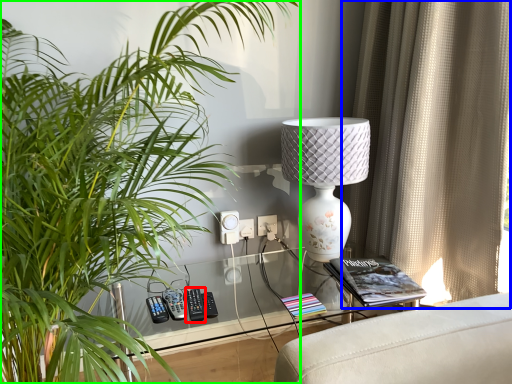
Question: Based on their relative distances, which object is farther from control (highlighted by a red box)? Choose from curtain (highlighted by a blue box) and houseplant (highlighted by a green box).

Choices:
 (A) curtain
 (B) houseplant

Answer: (A)